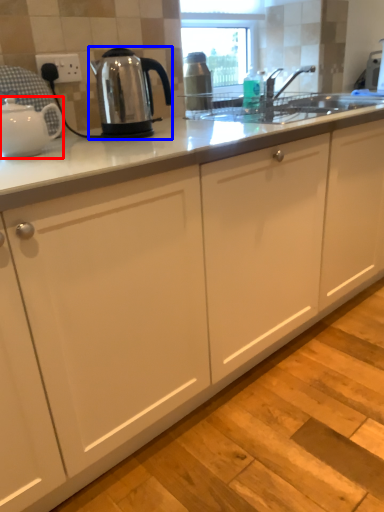
Question: Which point is further to the camera, kettle (highlighted by a red box) or kettle (highlighted by a blue box)?

Choices:
 (A) kettle
 (B) kettle

Answer: (B)